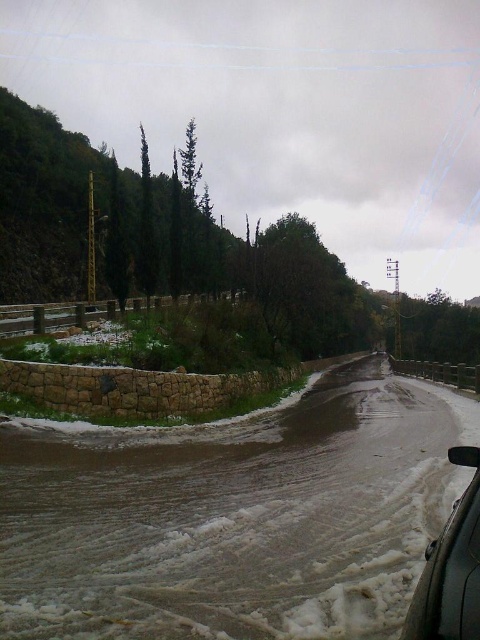
Does brown stone wall at lower left come in front of sleek black car at lower right?

No, it is not.

Which of these two, brown stone wall at lower left or sleek black car at lower right, stands taller?

With more height is brown stone wall at lower left.

Between point (384, 596) and point (472, 554), which one is positioned behind?

Point (384, 596)

The width and height of the screenshot is (480, 640). What are the coordinates of `brown stone wall at lower left` in the screenshot? It's located at (232, 516).